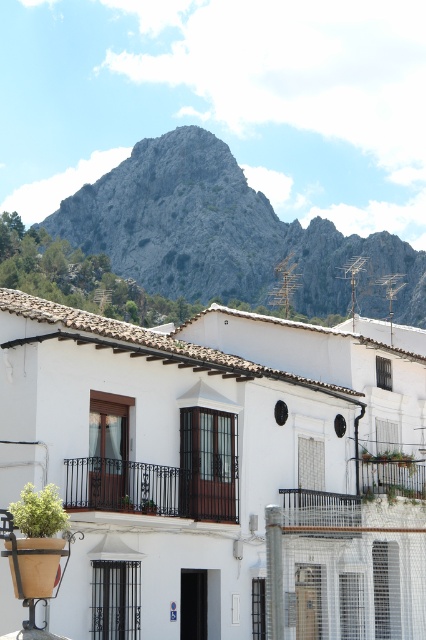
Question: Is rugged stone mountain at upper center closer to camera compared to metallic black balcony at center?

Choices:
 (A) no
 (B) yes

Answer: (A)

Question: Is rugged stone mountain at upper center to the left of black wrought iron balcony at center from the viewer's perspective?

Choices:
 (A) yes
 (B) no

Answer: (B)

Question: Considering the real-world distances, which object is farthest from the black wrought iron balcony at center?

Choices:
 (A) rugged stone mountain at upper center
 (B) metallic black balcony at center

Answer: (A)

Question: Does black wrought iron balcony at center appear on the left side of metallic black balcony at center?

Choices:
 (A) no
 (B) yes

Answer: (B)

Question: Which object is positioned closest to the black wrought iron balcony at center?

Choices:
 (A) rugged stone mountain at upper center
 (B) metallic black balcony at center

Answer: (B)

Question: Which of the following is the farthest from the observer?

Choices:
 (A) (224, 493)
 (B) (114, 216)

Answer: (B)